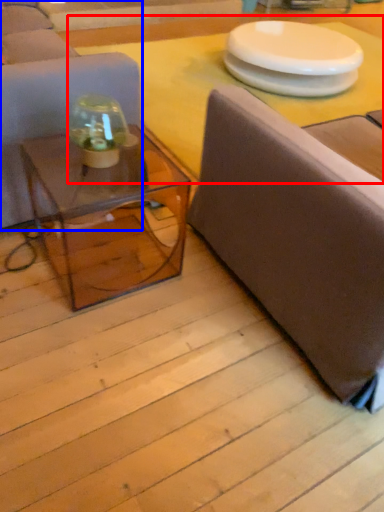
Question: Which object is closer to the camera taking this photo, table top (highlighted by a red box) or studio couch (highlighted by a blue box)?

Choices:
 (A) table top
 (B) studio couch

Answer: (B)